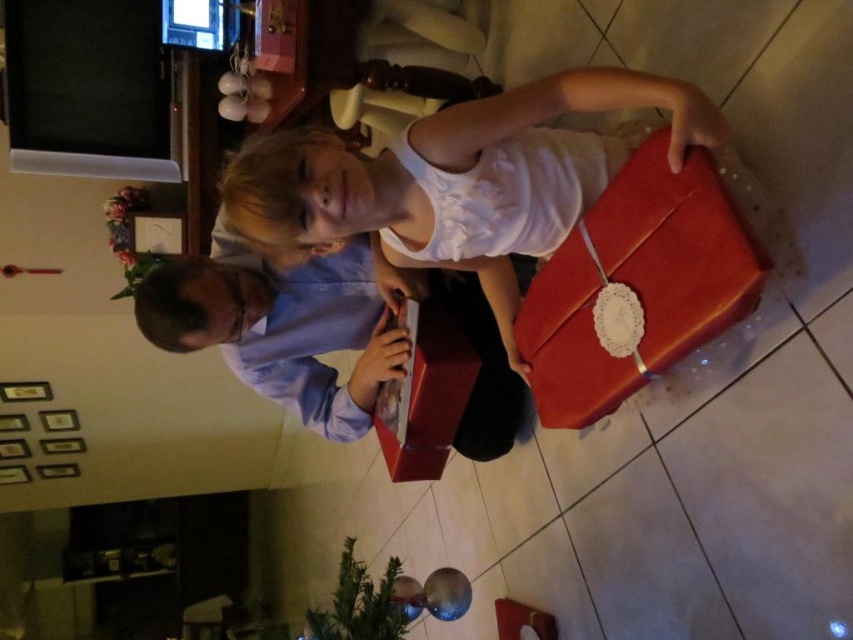
Measure the distance between matte white shirt at center and camera.

matte white shirt at center and camera are 1.14 meters apart.

Is matte white shirt at center above matte blue shirt at center?

Correct, matte white shirt at center is located above matte blue shirt at center.

Between point (457, 134) and point (286, 392), which one is positioned in front?

Positioned in front is point (457, 134).

Find the location of a particular element. This screenshot has width=853, height=640. matte white shirt at center is located at coordinates (457, 180).